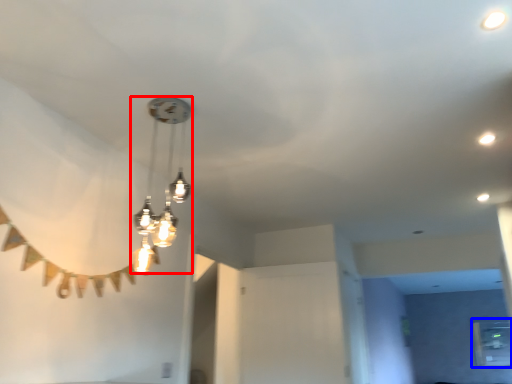
Question: Which point is further to the camera, lamp (highlighted by a red box) or window (highlighted by a blue box)?

Choices:
 (A) lamp
 (B) window

Answer: (B)